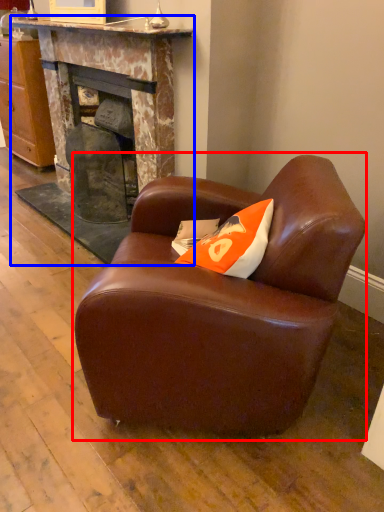
Question: Which object is closer to the camera taking this photo, chair (highlighted by a red box) or fireplace (highlighted by a blue box)?

Choices:
 (A) chair
 (B) fireplace

Answer: (A)